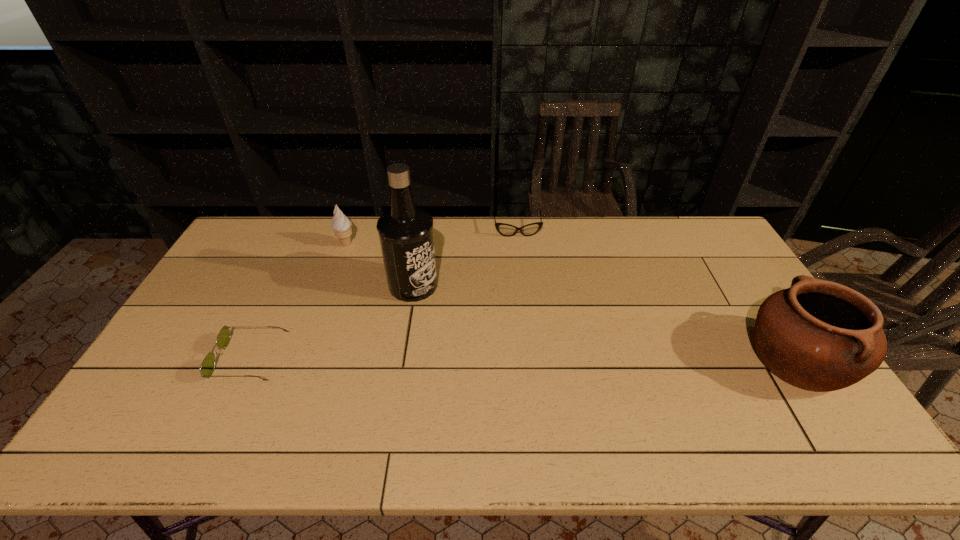
I want to click on sunglasses, so click(207, 367).

I want to click on pottery, so click(818, 335).

Find the location of `the second tallest object`. the second tallest object is located at coordinates (818, 335).

The image size is (960, 540). In order to click on the tallest object in this screenshot , I will do `click(406, 235)`.

Where is `the third nearest object`? This screenshot has height=540, width=960. the third nearest object is located at coordinates (406, 235).

You are a GUI agent. You are given a task and a screenshot of the screen. Output one action in this format:
    pyautogui.click(x=<x>, y=<y>)
    Task: Click on the fourth object from right to left
    
    Given the screenshot: What is the action you would take?
    pyautogui.click(x=341, y=225)

Find the location of a particular element. icecream is located at coordinates pyautogui.click(x=341, y=225).

You are a GUI agent. You are given a task and a screenshot of the screen. Output one action in this format:
    pyautogui.click(x=<x>, y=<y>)
    Task: Click on the farthest object
    
    Given the screenshot: What is the action you would take?
    pyautogui.click(x=507, y=230)

This screenshot has width=960, height=540. Find the location of `spectacles`. spectacles is located at coordinates pyautogui.click(x=507, y=230).

Where is `free space located 0.080m on the front-facing side of the sunglasses`? Image resolution: width=960 pixels, height=540 pixels. free space located 0.080m on the front-facing side of the sunglasses is located at coordinates (191, 359).